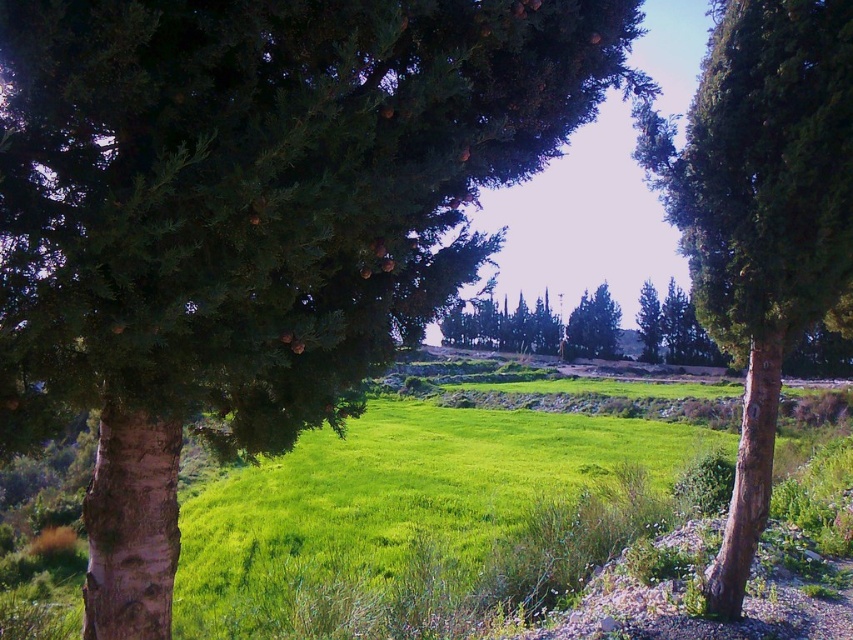
You are standing at the center of the field and want to walk towards the green rough bark tree at right. Which direction should you head?

The green rough bark tree at right is located at point 0.341 on the x and 0.893 on the y axis, so you should head towards the right and slightly forward direction to reach it.

You are planning to hang a swing between the green rough bark tree at right and the green leafy tree at center. Considering their thickness, which tree might be less suitable to support the swing?

The green rough bark tree at right is thinner than the green leafy tree at center, so it might be less suitable to support the swing due to its smaller trunk diameter.

You are standing in the serene outdoor scene and want to take a photo of the green rough bark tree at right. If your camera can focus on objects up to 5 meters away, will you need to move closer or farther away to ensure the tree is in focus?

The green rough bark tree at right is 5.23 meters away from the camera. Since your camera can focus up to 5 meters, you need to move closer to the tree to ensure it is within the focus range.